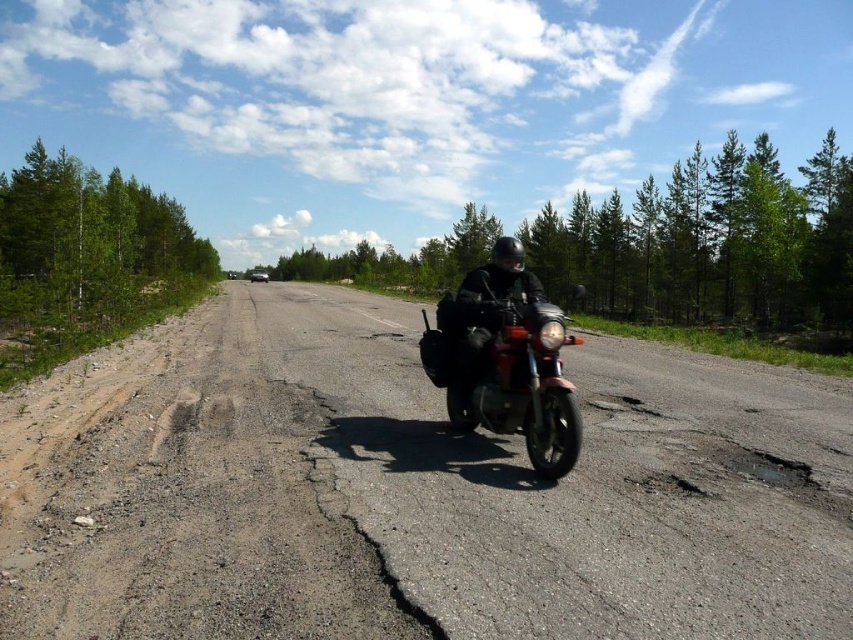
Question: Does dirtgravel/soiltrack at left have a larger size compared to matte black motorcycle at center?

Choices:
 (A) yes
 (B) no

Answer: (B)

Question: In this image, where is dirtgravel/soiltrack at left located relative to shiny chrome motorcycle at center?

Choices:
 (A) below
 (B) above

Answer: (A)

Question: Among these objects, which one is nearest to the camera?

Choices:
 (A) dirtgravel/soiltrack at left
 (B) shiny chrome motorcycle at center
 (C) matte black motorcycle at center

Answer: (A)

Question: Among these objects, which one is farthest from the camera?

Choices:
 (A) shiny chrome motorcycle at center
 (B) matte black motorcycle at center
 (C) dirtgravel/soiltrack at left

Answer: (B)

Question: Based on their relative distances, which object is farther from the shiny chrome motorcycle at center?

Choices:
 (A) dirtgravel/soiltrack at left
 (B) matte black motorcycle at center

Answer: (A)

Question: Observing the image, what is the correct spatial positioning of shiny chrome motorcycle at center in reference to matte black motorcycle at center?

Choices:
 (A) left
 (B) right

Answer: (B)